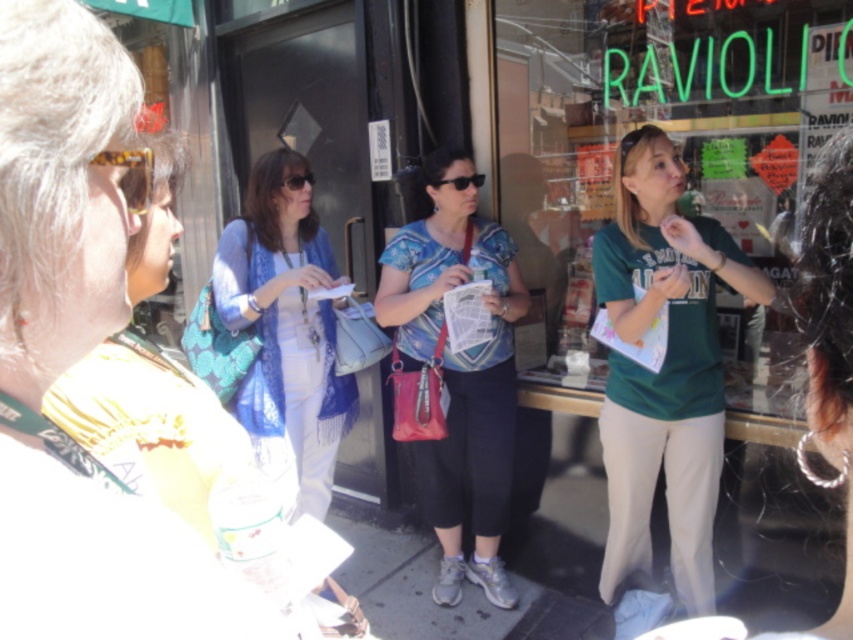
You are taking a photo of the group standing outside the ravioli restaurant. You want to focus on the person holding the map first. Which of the two points, point (x=97, y=156) or point (x=300, y=186), should you adjust your camera to focus on first?

Point (x=97, y=156) is closer to the camera than point (x=300, y=186), so you should focus on point (x=97, y=156) first to ensure the person holding the map is in clear view.

Consider the image. You are a customer trying to read the menu displayed on the storefront window. You have two items with you, the translucent amber goggles at left and the matte black sunglasses at center. Which item should you put on to better see through the glass window?

The translucent amber goggles at left are in front of the matte black sunglasses at center. Since the goggles are closer to the window, putting them on would allow you to see through the glass more clearly.